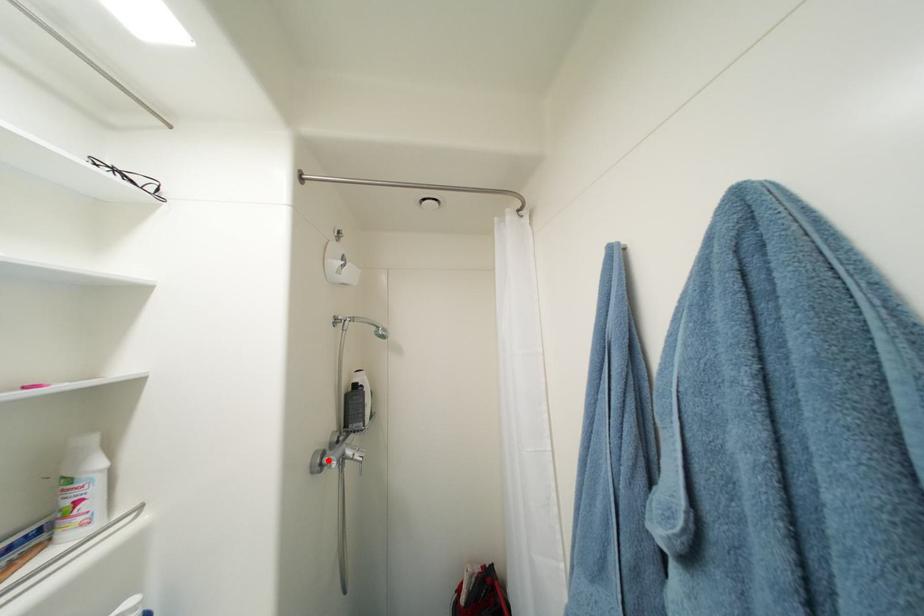
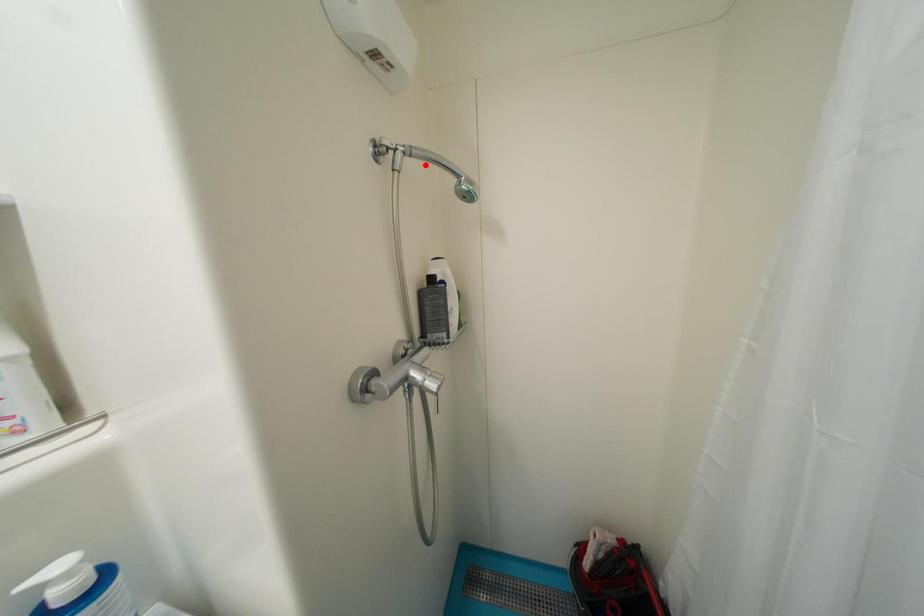
In the scene shown: I am providing you with two images of the same scene from different viewpoints. A red point is marked on the first image and another point is marked on the second image. Is the marked point in image1 the same physical position as the marked point in image2?

No